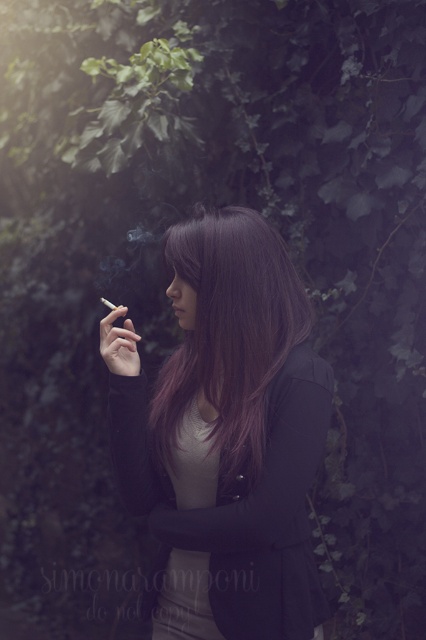
Looking at this image, does smooth black hair at center lie behind purple shiny hair at center?

No, smooth black hair at center is in front of purple shiny hair at center.

Who is more distant from viewer, [261,401] or [259,385]?

The point [259,385] is more distant.

What are the coordinates of `smooth black hair at center` in the screenshot? It's located at pyautogui.click(x=226, y=436).